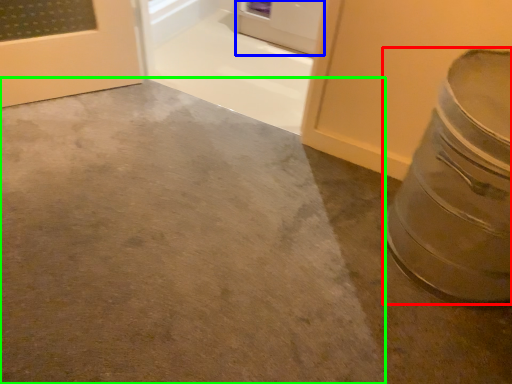
Question: Estimate the real-world distances between objects in this image. Which object is farther from crock pot (highlighted by a red box), door (highlighted by a blue box) or concrete (highlighted by a green box)?

Choices:
 (A) door
 (B) concrete

Answer: (A)